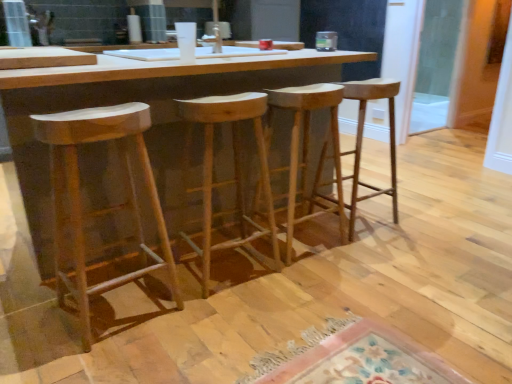
Where is `vacant space positioned to the left of natural wood stool at left, the 1th stool from the left`? vacant space positioned to the left of natural wood stool at left, the 1th stool from the left is located at coordinates (32, 313).